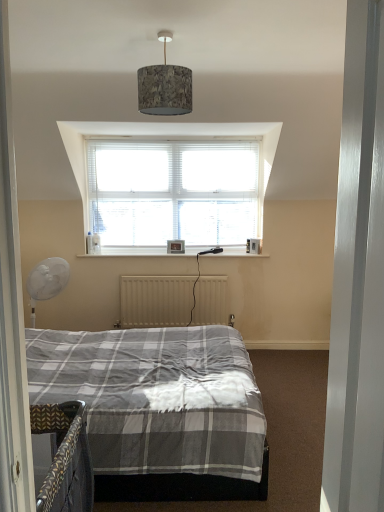
Question: Can we say textured fabric lampshade at upper center lies outside wooden picture frame at center?

Choices:
 (A) no
 (B) yes

Answer: (B)

Question: Is textured fabric lampshade at upper center to the right of wooden picture frame at center from the viewer's perspective?

Choices:
 (A) no
 (B) yes

Answer: (B)

Question: Can you confirm if textured fabric lampshade at upper center is thinner than wooden picture frame at center?

Choices:
 (A) no
 (B) yes

Answer: (A)

Question: Could you tell me if textured fabric lampshade at upper center is turned towards wooden picture frame at center?

Choices:
 (A) no
 (B) yes

Answer: (A)

Question: Considering the relative sizes of textured fabric lampshade at upper center and wooden picture frame at center in the image provided, is textured fabric lampshade at upper center taller than wooden picture frame at center?

Choices:
 (A) no
 (B) yes

Answer: (B)

Question: In terms of width, does metallic silver door at right look wider or thinner when compared to textured fabric lampshade at upper center?

Choices:
 (A) thin
 (B) wide

Answer: (A)

Question: Is point pyautogui.click(x=336, y=499) closer or farther from the camera than point pyautogui.click(x=139, y=84)?

Choices:
 (A) farther
 (B) closer

Answer: (B)

Question: Considering the positions of metallic silver door at right and textured fabric lampshade at upper center in the image, is metallic silver door at right taller or shorter than textured fabric lampshade at upper center?

Choices:
 (A) short
 (B) tall

Answer: (B)

Question: Considering their positions, is metallic silver door at right located in front of or behind textured fabric lampshade at upper center?

Choices:
 (A) front
 (B) behind

Answer: (A)

Question: Is textured fabric lampshade at upper center to the left or to the right of wooden picture frame at center in the image?

Choices:
 (A) right
 (B) left

Answer: (A)

Question: Considering the positions of textured fabric lampshade at upper center and wooden picture frame at center in the image, is textured fabric lampshade at upper center bigger or smaller than wooden picture frame at center?

Choices:
 (A) big
 (B) small

Answer: (A)

Question: From the image's perspective, is textured fabric lampshade at upper center positioned above or below wooden picture frame at center?

Choices:
 (A) below
 (B) above

Answer: (B)

Question: Considering the positions of textured fabric lampshade at upper center and wooden picture frame at center in the image, is textured fabric lampshade at upper center wider or thinner than wooden picture frame at center?

Choices:
 (A) thin
 (B) wide

Answer: (B)

Question: From a real-world perspective, is metallic silver door at right above or below beige metallic radiator at center?

Choices:
 (A) below
 (B) above

Answer: (B)

Question: From the image's perspective, is metallic silver door at right located above or below beige metallic radiator at center?

Choices:
 (A) below
 (B) above

Answer: (B)